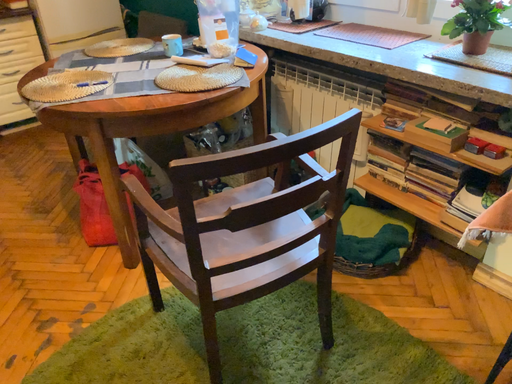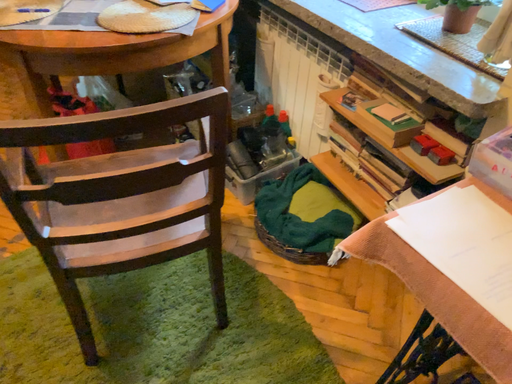
Question: Which way did the camera rotate in the video?

Choices:
 (A) rotated downward
 (B) rotated upward

Answer: (A)